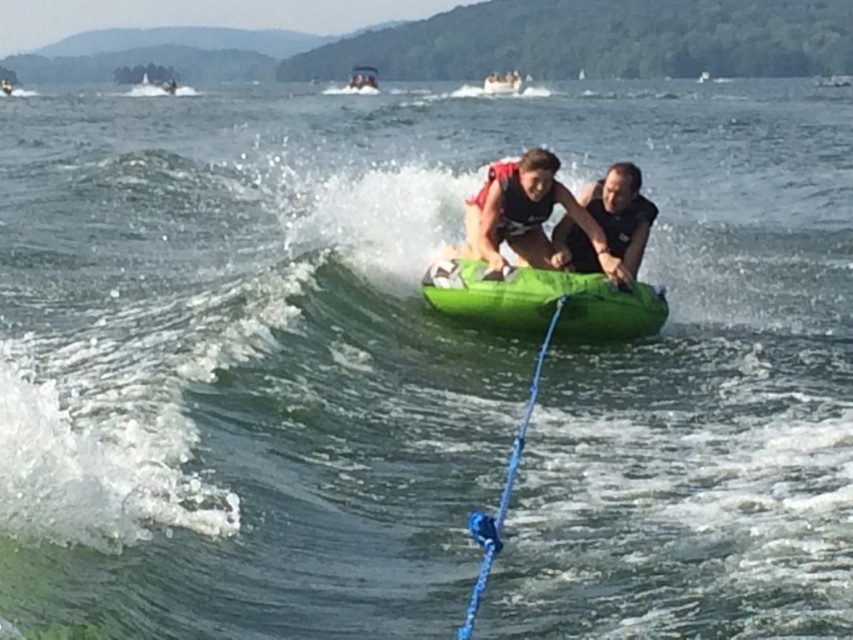
Question: Which point is closer to the camera taking this photo?

Choices:
 (A) (500, 84)
 (B) (590, 216)
 (C) (570, 321)
 (D) (596, 269)

Answer: (C)

Question: Does green rubber kayak at center have a larger size compared to black matte life vest at center?

Choices:
 (A) no
 (B) yes

Answer: (B)

Question: Among these objects, which one is farthest from the camera?

Choices:
 (A) green rubber kayak at center
 (B) matte green tube at center
 (C) black matte life vest at center

Answer: (C)

Question: Is green rubber kayak at center wider than matte green tube at center?

Choices:
 (A) no
 (B) yes

Answer: (B)

Question: Which point is closer to the camera?

Choices:
 (A) matte green tube at center
 (B) white plastic boat at upper center
 (C) black matte life vest at center

Answer: (A)

Question: Is matte green tube at center further to the viewer compared to green rubber tube at center?

Choices:
 (A) no
 (B) yes

Answer: (A)